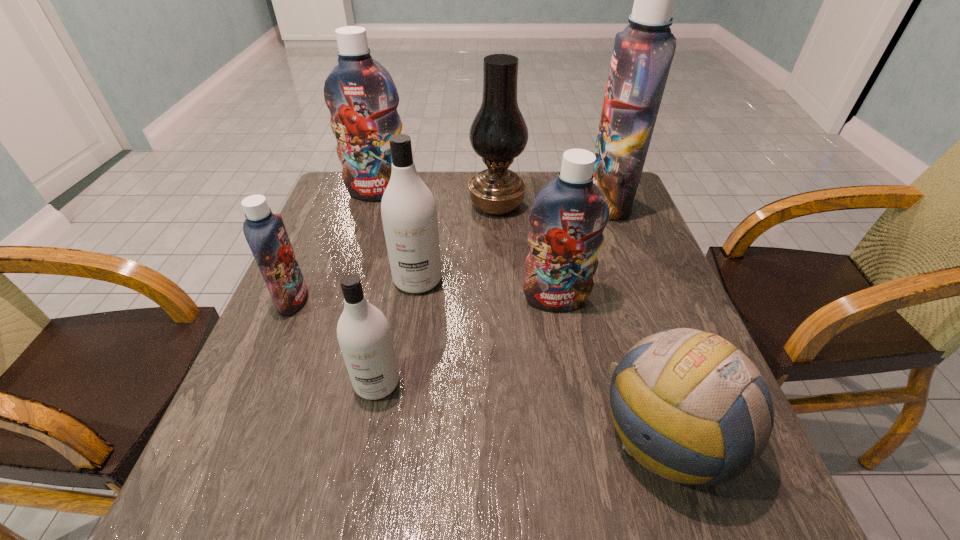
This screenshot has height=540, width=960. Identify the location of volleyball. (689, 406).

At what (x,y) coordinates should I click in order to perform the action: click on free point located on the front label of the rightmost shampoo. Please return your answer as a coordinate pair (x, y). Image resolution: width=960 pixels, height=540 pixels. Looking at the image, I should click on (462, 201).

Image resolution: width=960 pixels, height=540 pixels. What are the coordinates of `free space located 0.220m on the front label of the rightmost shampoo` in the screenshot? It's located at (513, 201).

Locate an element on the screen. free location located on the front label of the rightmost shampoo is located at coordinates [553, 201].

This screenshot has height=540, width=960. In order to click on vacant space located 0.400m on the front label of the second biggest blue shampoo in this screenshot , I will do `click(346, 300)`.

Find the location of a particular element. The image size is (960, 540). vacant area situated 0.350m on the front of the brown oil lamp is located at coordinates (502, 314).

Where is `free space located on the front-facing side of the farther white shampoo`? This screenshot has height=540, width=960. free space located on the front-facing side of the farther white shampoo is located at coordinates click(x=405, y=361).

Locate an element on the screen. This screenshot has height=540, width=960. vacant space located on the front label of the second blue shampoo from right to left is located at coordinates (572, 392).

You are a GUI agent. You are given a task and a screenshot of the screen. Output one action in this format:
    pyautogui.click(x=<x>, y=<y>)
    Task: Click on the blank space located on the front label of the smallest blue shampoo
    
    Given the screenshot: What is the action you would take?
    coord(365,301)

The width and height of the screenshot is (960, 540). Identify the location of vacant space located on the front-facing side of the smaller white shampoo. (355, 492).